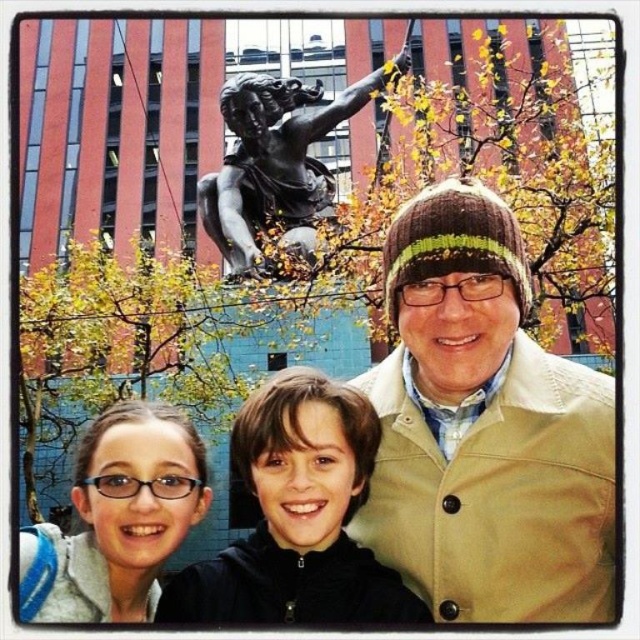
Who is positioned more to the right, black matte jacket at center or bronze statue at upper center?

From the viewer's perspective, bronze statue at upper center appears more on the right side.

Measure the distance between point (307, 396) and camera.

Point (307, 396) is 38.55 meters away from camera.

Identify the location of black matte jacket at center. (298, 516).

The width and height of the screenshot is (640, 640). I want to click on black matte jacket at center, so click(x=298, y=516).

Looking at this image, which is above, brown knit cap at upper right or matte gray backpack at lower left?

brown knit cap at upper right

Is brown knit cap at upper right closer to camera compared to matte gray backpack at lower left?

No, it is not.

This screenshot has width=640, height=640. What do you see at coordinates (484, 428) in the screenshot?
I see `brown knit cap at upper right` at bounding box center [484, 428].

The image size is (640, 640). What are the coordinates of `brown knit cap at upper right` in the screenshot? It's located at (484, 428).

At what (x,y) coordinates should I click in order to perform the action: click on brown knit cap at upper right. Please return your answer as a coordinate pair (x, y). The image size is (640, 640). Looking at the image, I should click on (484, 428).

Between point (541, 513) and point (346, 429), which one is positioned in front?

Point (541, 513) is more forward.

Is point (365, 518) positioned behind point (246, 580)?

Yes.

Locate an element on the screen. Image resolution: width=640 pixels, height=640 pixels. brown knit cap at upper right is located at coordinates click(x=484, y=428).